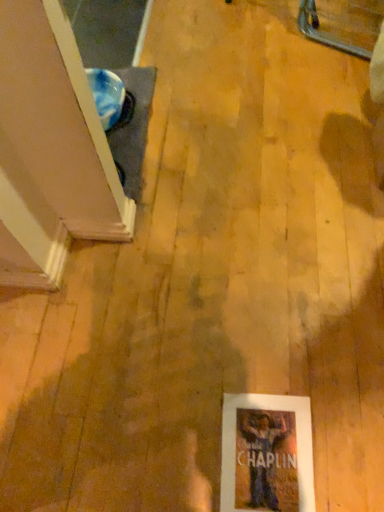
Locate an element on the screen. vacant space to the right of white paper poster at lower center is located at coordinates (340, 433).